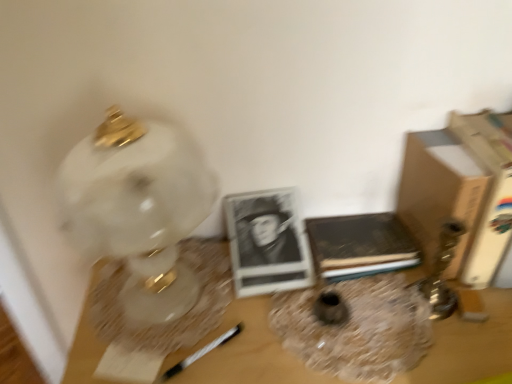
This screenshot has width=512, height=384. Describe the element at coordinates (245, 352) in the screenshot. I see `wooden table at center` at that location.

This screenshot has height=384, width=512. What do you see at coordinates (360, 245) in the screenshot?
I see `brown leather book at center, which ranks as the 1th paperback book in left-to-right order` at bounding box center [360, 245].

In order to face translucent glass vase at center, which is counted as the first vase, starting from the right, should I rotate leftwards or rightwards?

Turn right by 12.589 degrees to look at translucent glass vase at center, which is counted as the first vase, starting from the right.

Locate an element on the screen. The image size is (512, 384). translucent glass vase at center, acting as the second vase starting from the left is located at coordinates pyautogui.click(x=356, y=328).

Image resolution: width=512 pixels, height=384 pixels. What do you see at coordinates (440, 192) in the screenshot? I see `brown cardboard box at right` at bounding box center [440, 192].

Describe the element at coordinates (139, 210) in the screenshot. The height and width of the screenshot is (384, 512). I see `white marble lamp at left` at that location.

Where is `brown cardboard book at right, which is the 1th paperback book from right to left`? The height and width of the screenshot is (384, 512). brown cardboard book at right, which is the 1th paperback book from right to left is located at coordinates (490, 192).

Is matte glass vase at center, which ranks as the second vase in right-to-left order, positioned far away from wooden table at center?

Actually, matte glass vase at center, which ranks as the second vase in right-to-left order, and wooden table at center are a little close together.

Which object is positioned more to the left, matte glass vase at center, which ranks as the second vase in right-to-left order, or wooden table at center?

From the viewer's perspective, matte glass vase at center, which ranks as the second vase in right-to-left order, appears more on the left side.

Consider the image. From a real-world perspective, which object stands above the other?

matte glass vase at center, which ranks as the 1th vase in left-to-right order, is physically above.

Is point (330, 323) in front of point (291, 359)?

No, it is not.

Is brown cardboard book at right, the 2th paperback book from the left, inside brown cardboard box at right?

No, brown cardboard book at right, the 2th paperback book from the left, is not surrounded by brown cardboard box at right.

Looking at this image, from a real-world perspective, does brown cardboard box at right stand above brown cardboard book at right, which is the 1th paperback book from right to left?

No, from a real-world perspective, brown cardboard box at right is not on top of brown cardboard book at right, which is the 1th paperback book from right to left.

From the image's perspective, is brown cardboard box at right above or below brown cardboard book at right, which is the 1th paperback book from right to left?

Clearly, from the image's perspective, brown cardboard box at right is below brown cardboard book at right, which is the 1th paperback book from right to left.

Which of these two, brown cardboard box at right or translucent glass vase at center, acting as the second vase starting from the left, is smaller?

Smaller between the two is translucent glass vase at center, acting as the second vase starting from the left.

From the image's perspective, is brown cardboard box at right above or below translucent glass vase at center, acting as the second vase starting from the left?

Clearly, from the image's perspective, brown cardboard box at right is above translucent glass vase at center, acting as the second vase starting from the left.

Is brown cardboard box at right in front of or behind translucent glass vase at center, which is counted as the first vase, starting from the right, in the image?

brown cardboard box at right is positioned farther from the viewer than translucent glass vase at center, which is counted as the first vase, starting from the right.

Can you see brown leather book at center, which ranks as the 1th paperback book in left-to-right order, touching brown cardboard box at right?

No, brown leather book at center, which ranks as the 1th paperback book in left-to-right order, is not touching brown cardboard box at right.

Based on the photo, which of these two, brown leather book at center, which ranks as the 1th paperback book in left-to-right order, or brown cardboard box at right, stands taller?

brown cardboard box at right.

Which object is positioned more to the left, brown leather book at center, which ranks as the 1th paperback book in left-to-right order, or brown cardboard box at right?

brown leather book at center, which ranks as the 1th paperback book in left-to-right order.

Which is more to the right, wooden table at center or matte glass vase at center, which ranks as the 1th vase in left-to-right order?

wooden table at center is more to the right.

From a real-world perspective, is wooden table at center located higher than matte glass vase at center, which ranks as the second vase in right-to-left order?

No.

Which of these two, wooden table at center or matte glass vase at center, which ranks as the second vase in right-to-left order, is wider?

With larger width is wooden table at center.

Considering the sizes of objects brown leather book at center, positioned as the 2th paperback book in right-to-left order, and white marble lamp at left in the image provided, who is taller, brown leather book at center, positioned as the 2th paperback book in right-to-left order, or white marble lamp at left?

white marble lamp at left is taller.

From the image's perspective, which one is positioned lower, brown leather book at center, positioned as the 2th paperback book in right-to-left order, or white marble lamp at left?

From the image's view, brown leather book at center, positioned as the 2th paperback book in right-to-left order, is below.

Does brown leather book at center, which ranks as the 1th paperback book in left-to-right order, come behind white marble lamp at left?

Yes, the depth of brown leather book at center, which ranks as the 1th paperback book in left-to-right order, is greater than that of white marble lamp at left.

From a real-world perspective, is brown leather book at center, which ranks as the 1th paperback book in left-to-right order, under white marble lamp at left?

Yes, from a real-world perspective, brown leather book at center, which ranks as the 1th paperback book in left-to-right order, is under white marble lamp at left.

Is brown cardboard book at right, which is the 1th paperback book from right to left, bigger than brown leather book at center, which ranks as the 1th paperback book in left-to-right order?

Correct, brown cardboard book at right, which is the 1th paperback book from right to left, is larger in size than brown leather book at center, which ranks as the 1th paperback book in left-to-right order.

Does point (478, 232) lie behind point (381, 254)?

No, (478, 232) is in front of (381, 254).

Can you tell me how much brown cardboard book at right, which is the 1th paperback book from right to left, and brown leather book at center, positioned as the 2th paperback book in right-to-left order, differ in facing direction?

2.53 degrees separate the facing orientations of brown cardboard book at right, which is the 1th paperback book from right to left, and brown leather book at center, positioned as the 2th paperback book in right-to-left order.

Is brown cardboard book at right, which is the 1th paperback book from right to left, thinner than brown leather book at center, positioned as the 2th paperback book in right-to-left order?

No.

At what (x,y) coordinates should I click in order to perform the action: click on table that is below the matte glass vase at center, which ranks as the second vase in right-to-left order (from the image's perspective). Please return your answer as a coordinate pair (x, y). This screenshot has width=512, height=384. Looking at the image, I should click on pyautogui.click(x=245, y=352).

Locate an element on the screen. The width and height of the screenshot is (512, 384). cardboard box that appears behind the brown cardboard book at right, which is the 1th paperback book from right to left is located at coordinates (440, 192).

From the image, which object appears to be nearer to translucent glass vase at center, which is counted as the first vase, starting from the right, matte glass vase at center, which ranks as the 1th vase in left-to-right order, or wooden table at center?

Based on the image, matte glass vase at center, which ranks as the 1th vase in left-to-right order, appears to be nearer to translucent glass vase at center, which is counted as the first vase, starting from the right.

Considering their positions, is brown cardboard box at right positioned further to white marble lamp at left than wooden table at center?

Based on the image, brown cardboard box at right appears to be further to white marble lamp at left.

Based on their spatial positions, is brown cardboard book at right, the 2th paperback book from the left, or brown leather book at center, positioned as the 2th paperback book in right-to-left order, further from translucent glass vase at center, acting as the second vase starting from the left?

brown cardboard book at right, the 2th paperback book from the left, lies further to translucent glass vase at center, acting as the second vase starting from the left, than the other object.

Based on their spatial positions, is white marble lamp at left or brown cardboard book at right, which is the 1th paperback book from right to left, further from brown leather book at center, positioned as the 2th paperback book in right-to-left order?

white marble lamp at left is positioned further to the anchor brown leather book at center, positioned as the 2th paperback book in right-to-left order.

Looking at the image, which one is located closer to matte glass vase at center, which ranks as the 1th vase in left-to-right order, translucent glass vase at center, acting as the second vase starting from the left, or brown cardboard book at right, which is the 1th paperback book from right to left?

The object closer to matte glass vase at center, which ranks as the 1th vase in left-to-right order, is translucent glass vase at center, acting as the second vase starting from the left.

Estimate the real-world distances between objects in this image. Which object is further from brown leather book at center, positioned as the 2th paperback book in right-to-left order, brown cardboard box at right or matte glass vase at center, which ranks as the 1th vase in left-to-right order?

matte glass vase at center, which ranks as the 1th vase in left-to-right order, is positioned further to the anchor brown leather book at center, positioned as the 2th paperback book in right-to-left order.

Looking at the image, which one is located closer to brown cardboard book at right, the 2th paperback book from the left, wooden table at center or brown cardboard box at right?

Among the two, brown cardboard box at right is located nearer to brown cardboard book at right, the 2th paperback book from the left.

From the image, which object appears to be farther from brown leather book at center, which ranks as the 1th paperback book in left-to-right order, matte glass vase at center, which ranks as the second vase in right-to-left order, or translucent glass vase at center, acting as the second vase starting from the left?

Among the two, matte glass vase at center, which ranks as the second vase in right-to-left order, is located further to brown leather book at center, which ranks as the 1th paperback book in left-to-right order.

Where is `vase between translucent glass vase at center, which is counted as the first vase, starting from the right, and brown leather book at center, positioned as the 2th paperback book in right-to-left order, from front to back`? This screenshot has height=384, width=512. vase between translucent glass vase at center, which is counted as the first vase, starting from the right, and brown leather book at center, positioned as the 2th paperback book in right-to-left order, from front to back is located at coordinates (330, 308).

What are the coordinates of `cardboard box between translucent glass vase at center, which is counted as the first vase, starting from the right, and brown cardboard book at right, the 2th paperback book from the left, from left to right` in the screenshot? It's located at (440, 192).

I want to click on vase that lies between matte glass vase at center, which ranks as the 1th vase in left-to-right order, and wooden table at center from top to bottom, so click(356, 328).

The height and width of the screenshot is (384, 512). In order to click on table between white marble lamp at left and brown cardboard book at right, the 2th paperback book from the left, in the horizontal direction in this screenshot , I will do `click(245, 352)`.